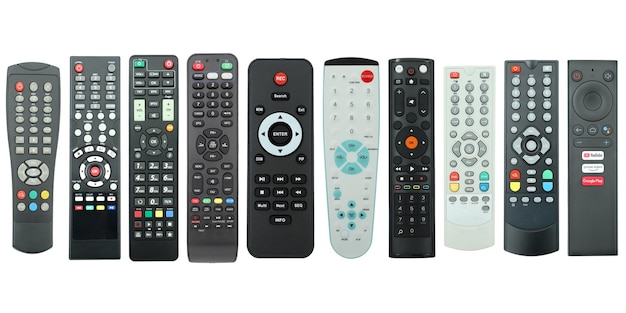
Locate an element on the screen. This screenshot has height=313, width=626. first 9 remote controls from the right of the image is located at coordinates (586, 145), (538, 154), (481, 148), (414, 145), (359, 143), (294, 142), (225, 146), (167, 152), (105, 153).